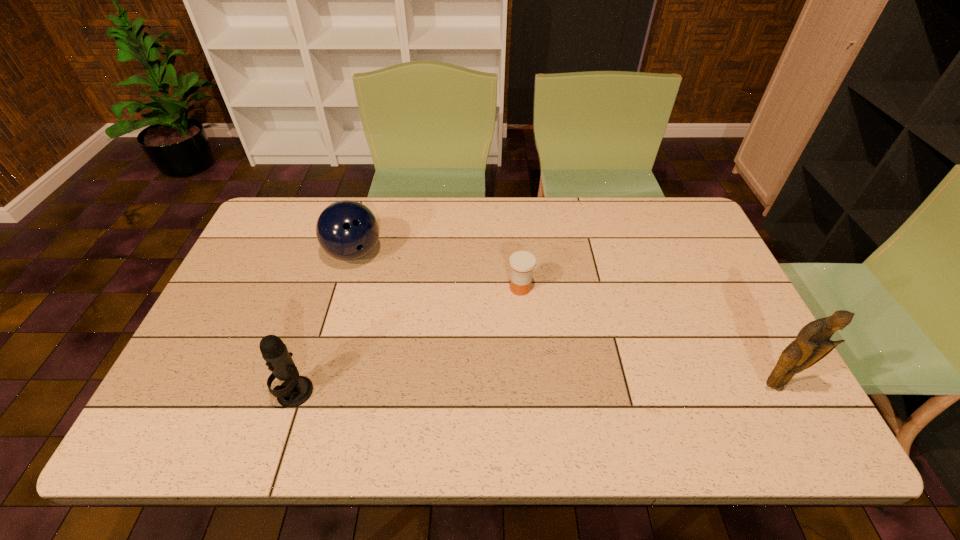
Identify the location of vacant space located on the label of the second farthest object. (540, 357).

Find the location of a particular element. blank space located on the label of the second farthest object is located at coordinates (533, 332).

Where is `free space located 0.140m on the label of the second farthest object`? The width and height of the screenshot is (960, 540). free space located 0.140m on the label of the second farthest object is located at coordinates (535, 338).

This screenshot has width=960, height=540. I want to click on object located at the far edge, so pyautogui.click(x=347, y=230).

Find the location of a particular element. This screenshot has height=540, width=960. microphone at the near edge is located at coordinates (295, 390).

Where is `figurine that is at the near edge`? This screenshot has height=540, width=960. figurine that is at the near edge is located at coordinates (812, 344).

Find the location of a particular element. This screenshot has width=960, height=540. object that is at the right edge is located at coordinates (812, 344).

Where is `object at the near right corner`? The image size is (960, 540). object at the near right corner is located at coordinates (812, 344).

You are a GUI agent. You are given a task and a screenshot of the screen. Output one action in this format:
    pyautogui.click(x=<x>, y=<y>)
    Task: Click on the free space at the far edge
    The image size is (960, 540).
    Given the screenshot: What is the action you would take?
    pyautogui.click(x=528, y=225)

You are a GUI agent. You are given a task and a screenshot of the screen. Output one action in this format:
    pyautogui.click(x=<x>, y=<y>)
    Task: Click on the vacant area at the near edge
    The height and width of the screenshot is (540, 960).
    Given the screenshot: What is the action you would take?
    pyautogui.click(x=325, y=385)